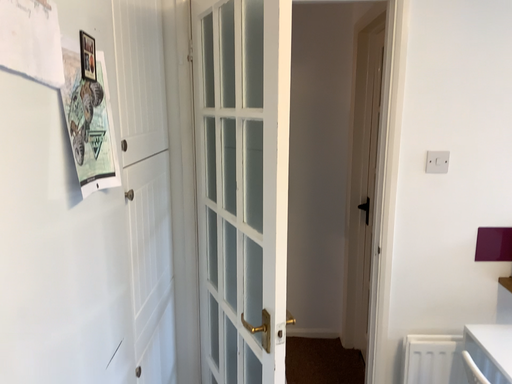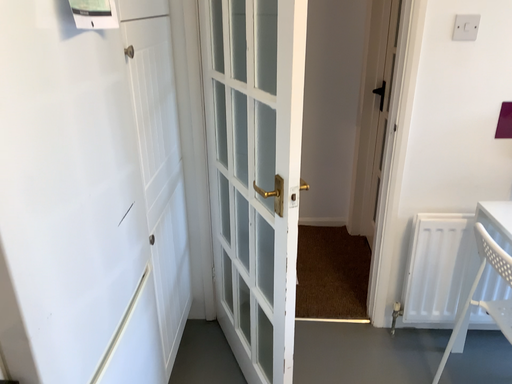
Question: How did the camera likely rotate when shooting the video?

Choices:
 (A) rotated upward
 (B) rotated downward

Answer: (B)